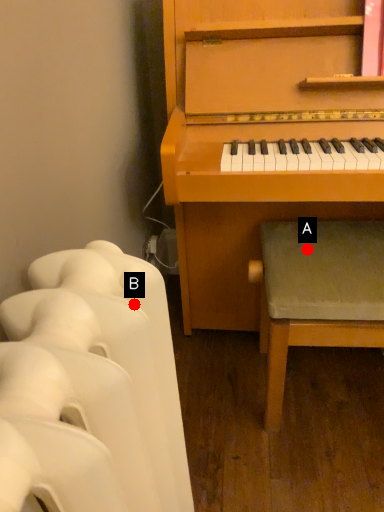
Question: Two points are circled on the image, labeled by A and B beside each circle. Which point is further to the camera?

Choices:
 (A) A is further
 (B) B is further

Answer: (A)